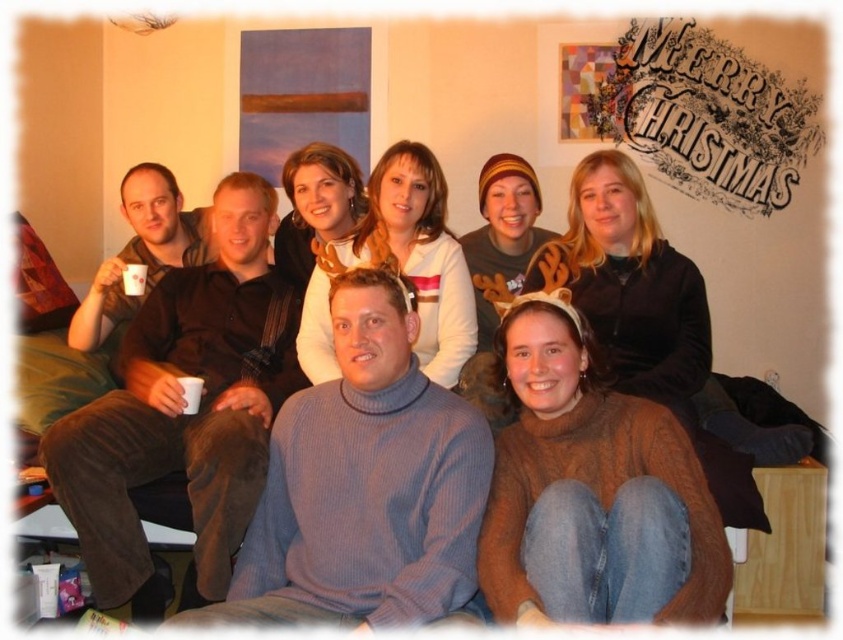
Question: Based on their relative distances, which object is nearer to the ribbed blue sweater at center?

Choices:
 (A) brown wool sweater at lower center
 (B) brown corduroy pants at left

Answer: (A)

Question: Which object is closer to the camera taking this photo?

Choices:
 (A) brown wool sweater at lower center
 (B) brown fuzzy sweater at center

Answer: (A)

Question: Does brown corduroy pants at left have a greater width compared to white sweater at center?

Choices:
 (A) no
 (B) yes

Answer: (B)

Question: Can you confirm if brown corduroy pants at left is positioned above brown fuzzy sweater at center?

Choices:
 (A) yes
 (B) no

Answer: (B)

Question: Does brown corduroy pants at left have a lesser width compared to brown wool sweater at lower center?

Choices:
 (A) yes
 (B) no

Answer: (B)

Question: Estimate the real-world distances between objects in this image. Which object is closer to the brown fuzzy sweater at center?

Choices:
 (A) ribbed blue sweater at center
 (B) white sweater at center
 (C) brown corduroy pants at left

Answer: (B)